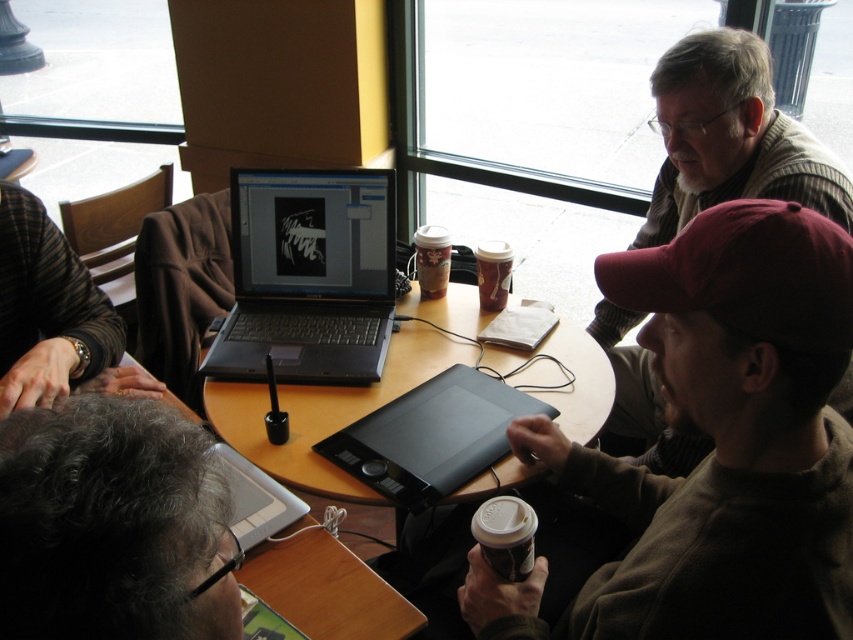
Which of these two, brown fuzzy sweater at center or gray curly hair at lower left, stands taller?

Standing taller between the two is brown fuzzy sweater at center.

Can you confirm if brown fuzzy sweater at center is thinner than gray curly hair at lower left?

Incorrect, brown fuzzy sweater at center's width is not less than gray curly hair at lower left's.

Does point (751, 465) come in front of point (3, 436)?

No.

Locate an element on the screen. brown fuzzy sweater at center is located at coordinates (729, 435).

Looking at this image, can you confirm if black plastic laptop at center is wider than wooden table at center?

No, black plastic laptop at center is not wider than wooden table at center.

Who is more distant from viewer, [311,330] or [231,422]?

Positioned behind is point [311,330].

Find the location of `black plastic laptop at center`. black plastic laptop at center is located at coordinates (308, 276).

Locate an element on the screen. The width and height of the screenshot is (853, 640). black plastic laptop at center is located at coordinates (308, 276).

Which of these two, black matte graphic tablet at center or brown paper cup at center, stands shorter?

brown paper cup at center is shorter.

Between black matte graphic tablet at center and brown paper cup at center, which one is positioned lower?

black matte graphic tablet at center is lower down.

What are the coordinates of `black matte graphic tablet at center` in the screenshot? It's located at (431, 436).